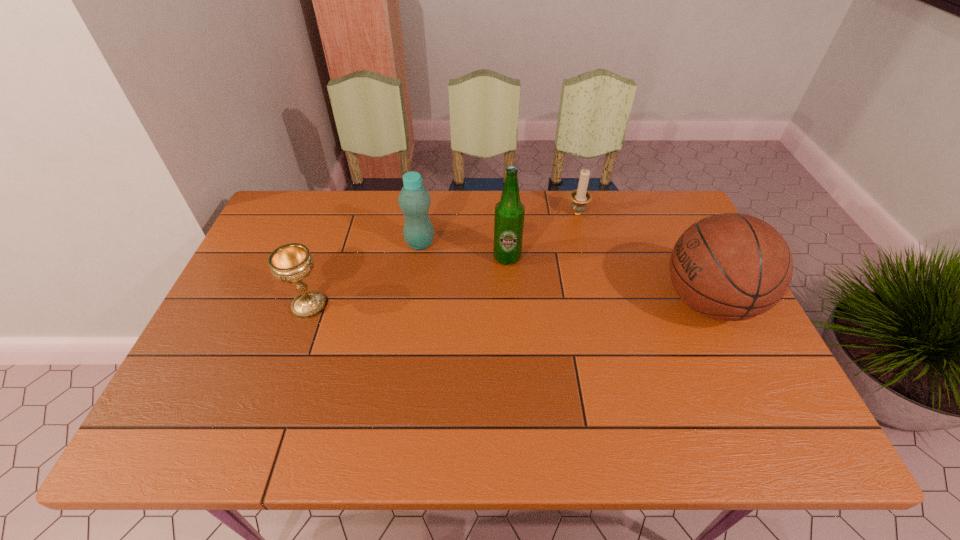
Locate an element on the screen. chalice is located at coordinates (290, 263).

Where is `the rightmost object`? the rightmost object is located at coordinates (731, 267).

Find the location of a particular element. The image size is (960, 540). candle_holder is located at coordinates (580, 197).

Locate an element on the screen. Image resolution: width=960 pixels, height=540 pixels. the fourth object from left to right is located at coordinates (580, 197).

Where is `water bottle`? This screenshot has width=960, height=540. water bottle is located at coordinates (414, 199).

You are a GUI agent. You are given a task and a screenshot of the screen. Output one action in this format:
    pyautogui.click(x=<x>, y=<y>)
    Task: Click on the third object from left to right
    The width and height of the screenshot is (960, 540).
    Given the screenshot: What is the action you would take?
    pyautogui.click(x=509, y=213)

The height and width of the screenshot is (540, 960). I want to click on blank space located on the back of the leftmost object, so click(341, 216).

Locate an element on the screen. vacant space situated on the side with brand label of the rightmost object is located at coordinates (588, 302).

Identify the location of free space located 0.290m on the side with brand label of the rightmost object. The width and height of the screenshot is (960, 540). (551, 302).

This screenshot has height=540, width=960. I want to click on free space located 0.240m on the side with brand label of the rightmost object, so click(x=569, y=302).